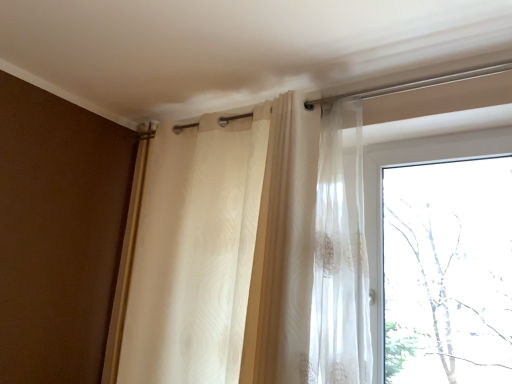
Question: From the image's perspective, is translucent fabric curtain at upper center on top of transparent glass window at upper right?

Choices:
 (A) no
 (B) yes

Answer: (B)

Question: Is translucent fabric curtain at upper center positioned beyond the bounds of transparent glass window at upper right?

Choices:
 (A) no
 (B) yes

Answer: (B)

Question: Considering the relative sizes of translucent fabric curtain at upper center and transparent glass window at upper right in the image provided, is translucent fabric curtain at upper center taller than transparent glass window at upper right?

Choices:
 (A) yes
 (B) no

Answer: (A)

Question: Is the depth of translucent fabric curtain at upper center greater than that of transparent glass window at upper right?

Choices:
 (A) no
 (B) yes

Answer: (A)

Question: From the image's perspective, is translucent fabric curtain at upper center located beneath transparent glass window at upper right?

Choices:
 (A) no
 (B) yes

Answer: (A)

Question: Is translucent fabric curtain at upper center far away from transparent glass window at upper right?

Choices:
 (A) yes
 (B) no

Answer: (B)

Question: Considering the relative sizes of transparent glass window at upper right and translucent fabric curtain at upper center in the image provided, is transparent glass window at upper right bigger than translucent fabric curtain at upper center?

Choices:
 (A) no
 (B) yes

Answer: (A)

Question: Is transparent glass window at upper right positioned before translucent fabric curtain at upper center?

Choices:
 (A) no
 (B) yes

Answer: (A)

Question: Can you confirm if transparent glass window at upper right is smaller than translucent fabric curtain at upper center?

Choices:
 (A) no
 (B) yes

Answer: (B)

Question: From a real-world perspective, is transparent glass window at upper right positioned over translucent fabric curtain at upper center based on gravity?

Choices:
 (A) no
 (B) yes

Answer: (B)

Question: Would you consider transparent glass window at upper right to be distant from translucent fabric curtain at upper center?

Choices:
 (A) no
 (B) yes

Answer: (A)

Question: Is transparent glass window at upper right oriented towards translucent fabric curtain at upper center?

Choices:
 (A) no
 (B) yes

Answer: (A)

Question: Looking at their shapes, would you say translucent fabric curtain at upper center is wider or thinner than transparent glass window at upper right?

Choices:
 (A) thin
 (B) wide

Answer: (B)